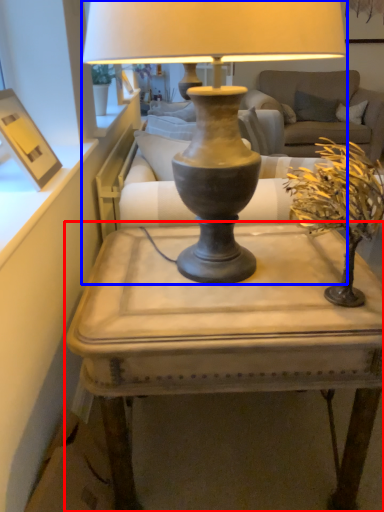
Question: Among these objects, which one is farthest to the camera, table (highlighted by a red box) or lamp (highlighted by a blue box)?

Choices:
 (A) table
 (B) lamp

Answer: (A)